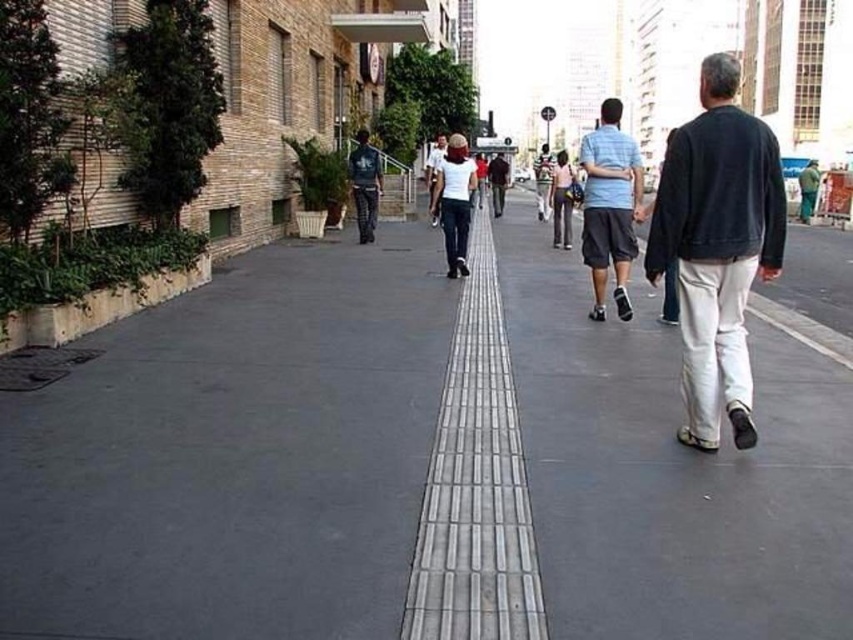
Question: Which point appears farthest from the camera in this image?

Choices:
 (A) (512, 621)
 (B) (651, 244)
 (C) (498, 205)
 (D) (850, 506)

Answer: (C)

Question: Is dark blue fleece jacket at right further to the viewer compared to dark blue jeans at center?

Choices:
 (A) yes
 (B) no

Answer: (B)

Question: Which of the following is the closest to the observer?

Choices:
 (A) dark blue jeans at center
 (B) silver textured paving at center
 (C) green fabric jacket at center

Answer: (B)

Question: Considering the relative positions of gray concrete sidewalk at center and white cotton shirt at center in the image provided, where is gray concrete sidewalk at center located with respect to white cotton shirt at center?

Choices:
 (A) right
 (B) left

Answer: (B)

Question: Which of the following is the farthest from the observer?

Choices:
 (A) (592, 161)
 (B) (756, 141)
 (C) (366, 224)
 (D) (804, 172)

Answer: (D)

Question: Can you confirm if silver textured paving at center is positioned to the left of green fabric jacket at center?

Choices:
 (A) no
 (B) yes

Answer: (B)